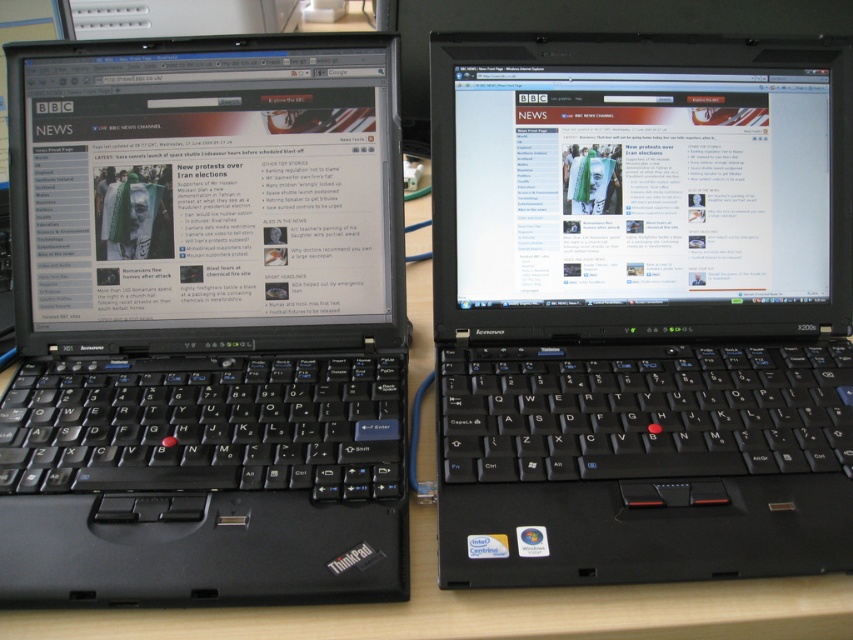
Can you confirm if black plastic laptop at center is smaller than black plastic laptop at left?

Actually, black plastic laptop at center might be larger than black plastic laptop at left.

Does black plastic laptop at center have a lesser height compared to black plastic laptop at left?

A: Yes, black plastic laptop at center is shorter than black plastic laptop at left.

Which is behind, point (766, 346) or point (36, 230)?

Positioned behind is point (766, 346).

Locate an element on the screen. black plastic laptop at center is located at coordinates (641, 307).

Which is behind, point (70, 212) or point (112, 192)?

Positioned behind is point (70, 212).

Measure the distance between black plastic laptop at left and camera.

black plastic laptop at left and camera are 16.97 inches apart.

Locate an element on the screen. The width and height of the screenshot is (853, 640). black plastic laptop at left is located at coordinates (207, 324).

How far apart are wooden table at center and green fabric couple at center?

They are 31.56 centimeters apart.

Identify the location of wooden table at center. tap(491, 609).